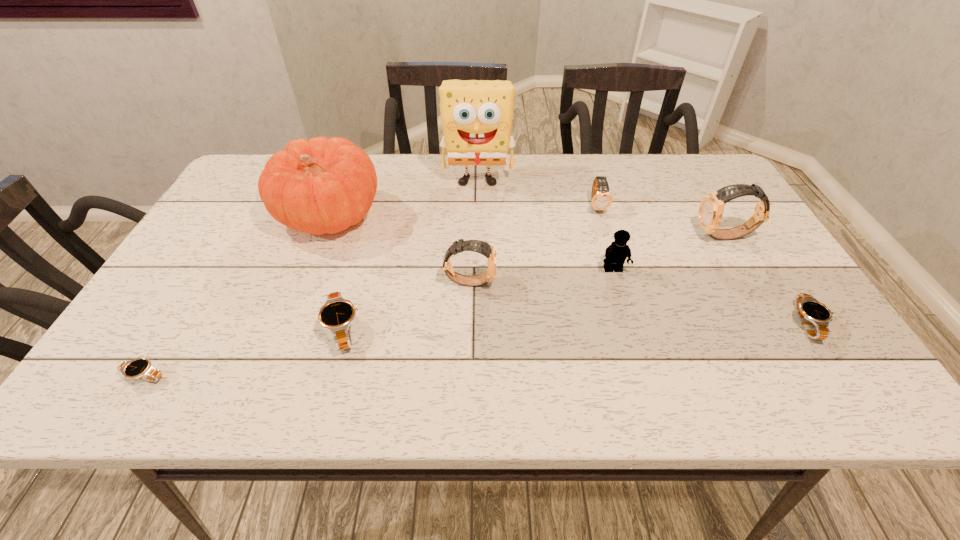
You are a GUI agent. You are given a task and a screenshot of the screen. Output one action in this format:
    pyautogui.click(x=<x>, y=<y>)
    Task: Click on the blank area located 0.380m on the face of the biggest gold watch
    This screenshot has width=960, height=540.
    Given the screenshot: What is the action you would take?
    pyautogui.click(x=550, y=237)

You are a GUI agent. You are given a task and a screenshot of the screen. Output one action in this format:
    pyautogui.click(x=<x>, y=<y>)
    Task: Click on the free spot located on the face of the biggest gold watch
    The height and width of the screenshot is (540, 960).
    Given the screenshot: What is the action you would take?
    pyautogui.click(x=573, y=237)

This screenshot has height=540, width=960. Find the location of `vacant space located 0.290m on the face of the second tallest watch`. vacant space located 0.290m on the face of the second tallest watch is located at coordinates (618, 281).

The image size is (960, 540). Find the location of `free space located 0.260m on the front-facing side of the Lego`. free space located 0.260m on the front-facing side of the Lego is located at coordinates (643, 372).

Locate an element on the screen. The image size is (960, 540). vacant space located 0.080m on the face of the fourth shortest watch is located at coordinates (606, 235).

Where is `free spot located 0.200m on the back of the third shortest watch`? The width and height of the screenshot is (960, 540). free spot located 0.200m on the back of the third shortest watch is located at coordinates (366, 243).

The width and height of the screenshot is (960, 540). In order to click on vacant space located on the back of the second biggest black watch in this screenshot , I will do `click(731, 205)`.

Image resolution: width=960 pixels, height=540 pixels. What are the coordinates of `free location located 0.170m on the back of the leftmost object` in the screenshot? It's located at (190, 302).

Identify the location of sponge located at the far edge. The image size is (960, 540). (476, 115).

Where is `pumpkin at the far edge`? pumpkin at the far edge is located at coordinates (323, 185).